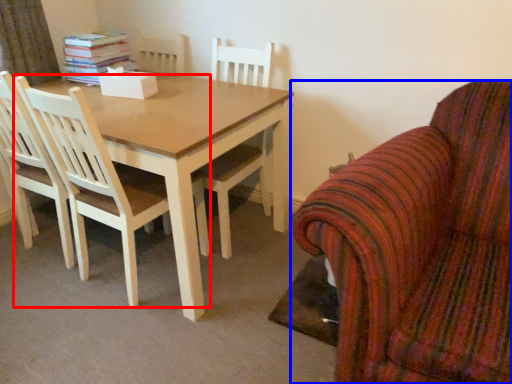
Question: Which object is closer to the camera taking this photo, chair (highlighted by a red box) or chair (highlighted by a blue box)?

Choices:
 (A) chair
 (B) chair

Answer: (B)